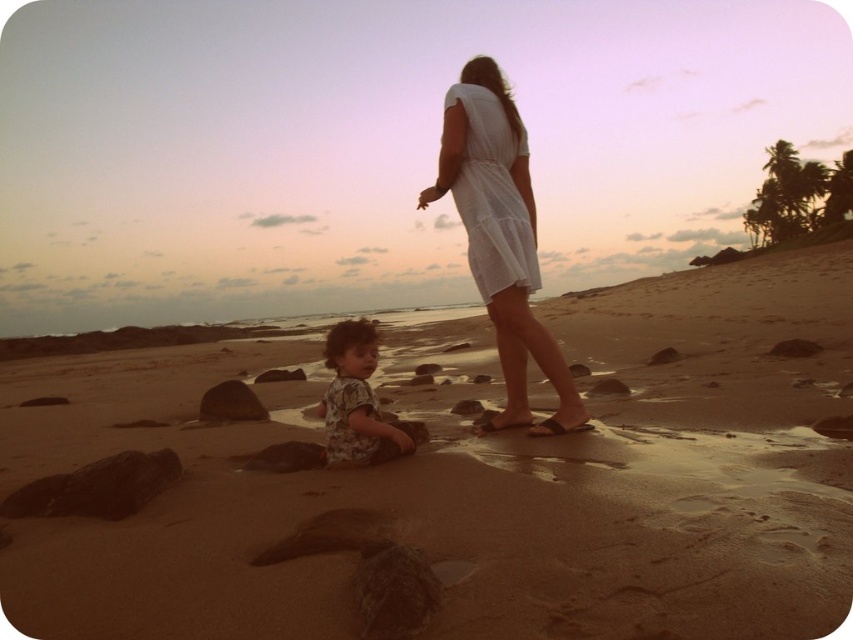
You are a photographer standing at the edge of the beach. You want to take a photo of the sandy brown sand at center and the smooth brown rock at lower center. Which object should you focus on first if you want both to be in sharp focus?

The sandy brown sand at center is in front of the smooth brown rock at lower center, so you should focus on the smooth brown rock at lower center first to ensure both are in sharp focus.

You are a photographer trying to capture the entire beach scene in one shot. Given that your camera has a limited field of view, which object between the sandy brown sand at center and the rusty metallic rock at lower left should you prioritize framing first to ensure both are visible?

The sandy brown sand at center might be wider than the rusty metallic rock at lower left, so you should prioritize framing the rusty metallic rock at lower left first to ensure both objects fit within the camera frame.